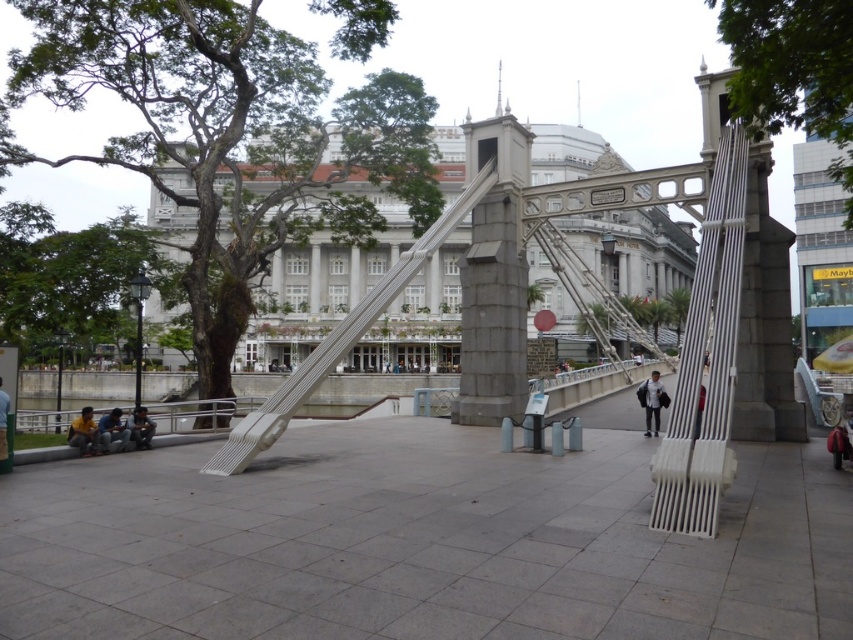
Between green leafy tree at left and matte white bench at center, which one has more height?

green leafy tree at left

From the picture: Is green leafy tree at left to the left of matte white bench at center from the viewer's perspective?

Correct, you'll find green leafy tree at left to the left of matte white bench at center.

Is point (28, 209) positioned before point (699, 426)?

No.

The width and height of the screenshot is (853, 640). In order to click on green leafy tree at left in this screenshot , I will do `click(65, 276)`.

Does white metallic suspension bridge at center have a lesser width compared to green leafy tree at left?

Yes.

Who is shorter, white metallic suspension bridge at center or green leafy tree at left?

green leafy tree at left is shorter.

You are a GUI agent. You are given a task and a screenshot of the screen. Output one action in this format:
    pyautogui.click(x=<x>, y=<y>)
    Task: Click on the white metallic suspension bridge at center
    The image size is (853, 640).
    Given the screenshot: What is the action you would take?
    pyautogui.click(x=515, y=310)

You are a GUI agent. You are given a task and a screenshot of the screen. Output one action in this format:
    pyautogui.click(x=<x>, y=<y>)
    Task: Click on the white metallic suspension bridge at center
    
    Given the screenshot: What is the action you would take?
    pyautogui.click(x=515, y=310)

Is white metallic suspension bridge at center bigger than blue jeans at lower left?

Correct, white metallic suspension bridge at center is larger in size than blue jeans at lower left.

Does point (505, 184) lie behind point (115, 433)?

That is True.

Between point (291, 392) and point (112, 433), which one is positioned behind?

Positioned behind is point (112, 433).

Where is `white metallic suspension bridge at center`? white metallic suspension bridge at center is located at coordinates (515, 310).